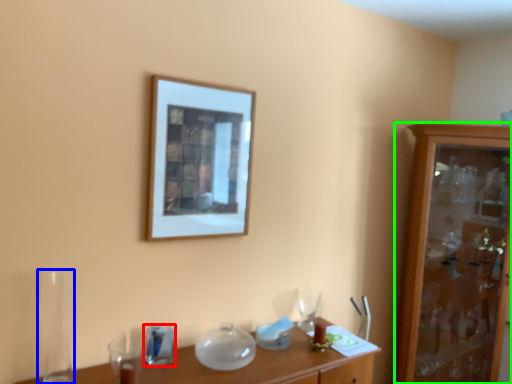
Question: Which is nearer to the tableware (highlighted by a red box)? glass vase (highlighted by a blue box) or cabinetry (highlighted by a green box).

Choices:
 (A) glass vase
 (B) cabinetry

Answer: (A)